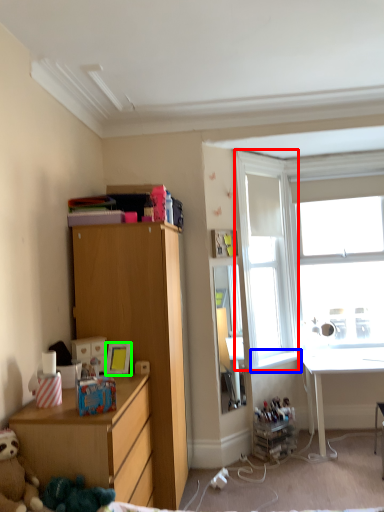
Question: Estimate the real-world distances between objects in this image. Which object is farther from window screen (highlighted by a red box), window sill (highlighted by a blue box) or picture frame (highlighted by a green box)?

Choices:
 (A) window sill
 (B) picture frame

Answer: (B)